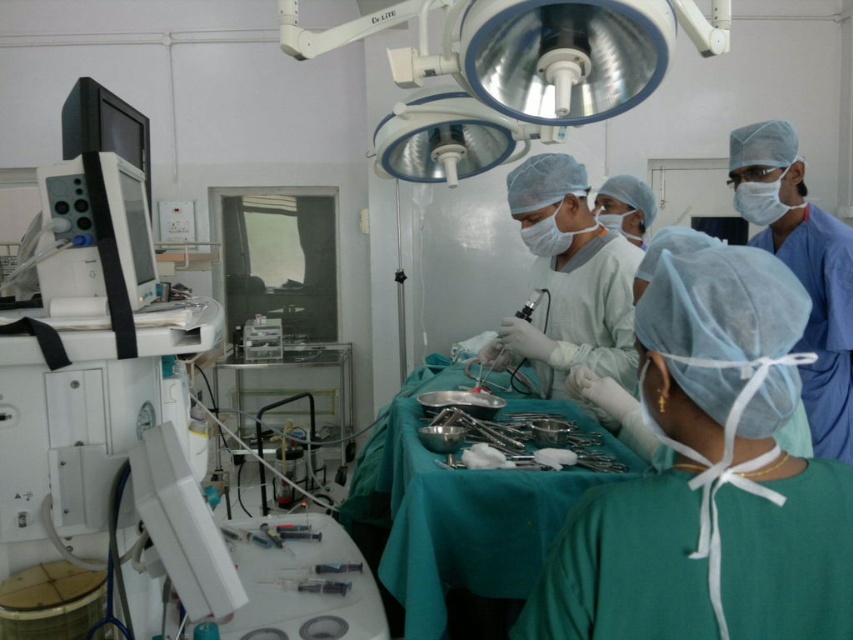
Question: Which object is closer to the camera taking this photo?

Choices:
 (A) white smooth surgical gown at center
 (B) blue smooth scrubs at right
 (C) satin silver surgical instrument at center

Answer: (B)

Question: Is the position of green surgical gown at center more distant than that of satin silver surgical instrument at center?

Choices:
 (A) yes
 (B) no

Answer: (B)

Question: Does clear plastic syringe at lower center have a lesser width compared to satin silver surgical instrument at center?

Choices:
 (A) yes
 (B) no

Answer: (A)

Question: Which point appears closest to the camera in this image?

Choices:
 (A) (846, 412)
 (B) (329, 593)

Answer: (B)

Question: Is green surgical gown at center below clear plastic syringe at lower center?

Choices:
 (A) no
 (B) yes

Answer: (A)

Question: Which point is closer to the camera?

Choices:
 (A) (767, 161)
 (B) (689, 285)
 (C) (496, 333)
 (D) (299, 580)

Answer: (B)